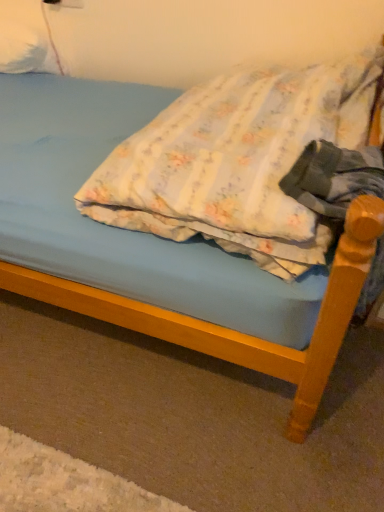
Question: Is white fluffy pillow at upper left, which is the 1th pillow in left-to-right order, wider than floral fabric pillow at center, which is counted as the second pillow, starting from the top?

Choices:
 (A) no
 (B) yes

Answer: (A)

Question: From the image's perspective, would you say white fluffy pillow at upper left, which is the 1th pillow in left-to-right order, is shown under floral fabric pillow at center, which is counted as the second pillow, starting from the top?

Choices:
 (A) yes
 (B) no

Answer: (B)

Question: From the image's perspective, is white fluffy pillow at upper left, which appears as the first pillow when viewed from the back, over floral fabric pillow at center, the second pillow in the left-to-right sequence?

Choices:
 (A) yes
 (B) no

Answer: (A)

Question: Considering the relative positions of white fluffy pillow at upper left, which appears as the first pillow when viewed from the back, and floral fabric pillow at center, which is the 1th pillow in right-to-left order, in the image provided, is white fluffy pillow at upper left, which appears as the first pillow when viewed from the back, to the right of floral fabric pillow at center, which is the 1th pillow in right-to-left order, from the viewer's perspective?

Choices:
 (A) yes
 (B) no

Answer: (B)

Question: Considering the relative sizes of white fluffy pillow at upper left, which is counted as the first pillow, starting from the top, and floral fabric pillow at center, the second pillow in the left-to-right sequence, in the image provided, is white fluffy pillow at upper left, which is counted as the first pillow, starting from the top, smaller than floral fabric pillow at center, the second pillow in the left-to-right sequence,?

Choices:
 (A) no
 (B) yes

Answer: (B)

Question: Can you confirm if white fluffy pillow at upper left, which appears as the first pillow when viewed from the back, is bigger than floral fabric pillow at center, positioned as the first pillow in front-to-back order?

Choices:
 (A) yes
 (B) no

Answer: (B)

Question: Is floral fabric pillow at center, acting as the second pillow starting from the back, bigger than white fluffy pillow at upper left, which appears as the 2th pillow when viewed from the front?

Choices:
 (A) no
 (B) yes

Answer: (B)

Question: From the image's perspective, is floral fabric pillow at center, which is the 1th pillow in right-to-left order, below white fluffy pillow at upper left, which is the 1th pillow in left-to-right order?

Choices:
 (A) yes
 (B) no

Answer: (A)

Question: Is floral fabric pillow at center, the first pillow ordered from the bottom, further to the viewer compared to white fluffy pillow at upper left, which appears as the 2th pillow when viewed from the front?

Choices:
 (A) no
 (B) yes

Answer: (A)

Question: Can you confirm if floral fabric pillow at center, which is counted as the second pillow, starting from the top, is thinner than white fluffy pillow at upper left, positioned as the second pillow in bottom-to-top order?

Choices:
 (A) yes
 (B) no

Answer: (B)

Question: From a real-world perspective, is floral fabric pillow at center, which is counted as the second pillow, starting from the top, under white fluffy pillow at upper left, which appears as the first pillow when viewed from the back?

Choices:
 (A) yes
 (B) no

Answer: (A)

Question: Is there a large distance between floral fabric pillow at center, positioned as the first pillow in front-to-back order, and white fluffy pillow at upper left, positioned as the second pillow in bottom-to-top order?

Choices:
 (A) no
 (B) yes

Answer: (B)

Question: From a real-world perspective, is white fluffy pillow at upper left, which is counted as the first pillow, starting from the top, physically located above or below floral fabric pillow at center, the first pillow ordered from the bottom?

Choices:
 (A) above
 (B) below

Answer: (A)